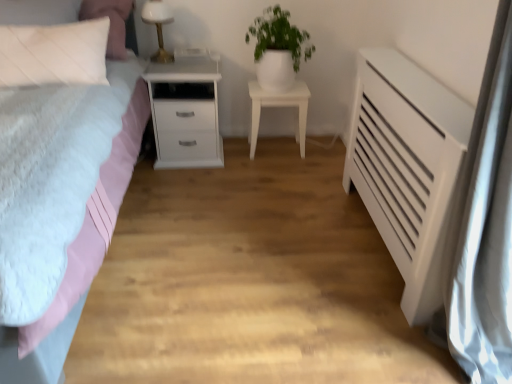
Describe the element at coordinates (158, 26) in the screenshot. This screenshot has height=384, width=512. I see `white glossy table lamp at upper center` at that location.

The image size is (512, 384). I want to click on white quilted pillow at upper left, so coord(54,53).

Describe the element at coordinates (186, 110) in the screenshot. Image resolution: width=512 pixels, height=384 pixels. I see `white matte nightstand at left, the 2th nightstand in the right-to-left sequence` at that location.

Identify the location of white glossy table lamp at upper center. (158, 26).

From the image's perspective, which is above, white glossy pot at upper center or white matte radiator at right?

white glossy pot at upper center.

Considering the positions of objects white glossy pot at upper center and white matte radiator at right in the image provided, who is more to the left, white glossy pot at upper center or white matte radiator at right?

→ white glossy pot at upper center is more to the left.

Is white glossy pot at upper center looking in the opposite direction of white matte radiator at right?

No, white glossy pot at upper center is not facing away from white matte radiator at right.

Where is `plant behind the white matte radiator at right`? plant behind the white matte radiator at right is located at coordinates (279, 36).

Is there a large distance between white glossy table lamp at upper center and matte pink bed at left?

No, white glossy table lamp at upper center is not far away from matte pink bed at left.

Could you tell me if white glossy table lamp at upper center is facing matte pink bed at left?

No, white glossy table lamp at upper center is not facing towards matte pink bed at left.

Can you confirm if white glossy table lamp at upper center is positioned to the right of matte pink bed at left?

Correct, you'll find white glossy table lamp at upper center to the right of matte pink bed at left.

Considering the points (157, 11) and (305, 116), which point is behind, point (157, 11) or point (305, 116)?

Positioned behind is point (305, 116).

From a real-world perspective, which is physically above, white glossy table lamp at upper center or white glossy nightstand at center, marked as the 1th nightstand in a right-to-left arrangement?

In real-world perspective, white glossy table lamp at upper center is above.

Measure the distance between white glossy table lamp at upper center and white glossy nightstand at center, marked as the 1th nightstand in a right-to-left arrangement.

30.68 inches.

From the picture: Does white glossy table lamp at upper center contain white glossy nightstand at center, acting as the second nightstand starting from the left?

No, white glossy nightstand at center, acting as the second nightstand starting from the left, is not inside white glossy table lamp at upper center.

From a real-world perspective, which object rests below the other?

white glossy nightstand at center, acting as the second nightstand starting from the left, is physically lower.

How different are the orientations of white matte radiator at right and white glossy nightstand at center, acting as the second nightstand starting from the left, in degrees?

84 degrees separate the facing orientations of white matte radiator at right and white glossy nightstand at center, acting as the second nightstand starting from the left.

Which object is further away from the camera, white matte radiator at right or white glossy nightstand at center, acting as the second nightstand starting from the left?

white glossy nightstand at center, acting as the second nightstand starting from the left, is behind.

Which object is wider, white matte radiator at right or white glossy nightstand at center, acting as the second nightstand starting from the left?

Wider between the two is white matte radiator at right.

Is the position of matte pink bed at left more distant than that of white glossy table lamp at upper center?

No, the depth of matte pink bed at left is less than that of white glossy table lamp at upper center.

Which of these two, matte pink bed at left or white glossy table lamp at upper center, is wider?

Wider between the two is matte pink bed at left.

Is point (31, 70) farther from viewer compared to point (161, 59)?

No, it is not.

Between white quilted pillow at upper left and white glossy table lamp at upper center, which one has larger width?

white quilted pillow at upper left.

The height and width of the screenshot is (384, 512). I want to click on table lamp above the white quilted pillow at upper left (from the image's perspective), so pyautogui.click(x=158, y=26).

Which of these two, white glossy pot at upper center or white quilted pillow at upper left, is smaller?

Smaller between the two is white quilted pillow at upper left.

Find the location of a particular element. The image size is (512, 384). plant above the white quilted pillow at upper left (from the image's perspective) is located at coordinates (279, 36).

Is white glossy pot at upper center further to camera compared to white quilted pillow at upper left?

Yes, white glossy pot at upper center is further from the viewer.

Considering the sizes of objects white glossy pot at upper center and white quilted pillow at upper left in the image provided, who is taller, white glossy pot at upper center or white quilted pillow at upper left?

Standing taller between the two is white glossy pot at upper center.

Image resolution: width=512 pixels, height=384 pixels. Identify the location of plant that is on the left side of white matte radiator at right. (279, 36).

The image size is (512, 384). What are the coordinates of `table lamp above the matte pink bed at left (from the image's perspective)` in the screenshot? It's located at (158, 26).

Considering their positions, is white glossy pot at upper center positioned further to white matte nightstand at left, marked as the 1th nightstand in a left-to-right arrangement, than white matte radiator at right?

white matte radiator at right is positioned further to the anchor white matte nightstand at left, marked as the 1th nightstand in a left-to-right arrangement.

From the image, which object appears to be nearer to matte pink bed at left, white glossy table lamp at upper center or white matte nightstand at left, marked as the 1th nightstand in a left-to-right arrangement?

white matte nightstand at left, marked as the 1th nightstand in a left-to-right arrangement.

Looking at the image, which one is located further to white matte radiator at right, white glossy table lamp at upper center or white matte nightstand at left, the 2th nightstand in the right-to-left sequence?

white glossy table lamp at upper center lies further to white matte radiator at right than the other object.

Looking at the image, which one is located further to white glossy table lamp at upper center, white matte nightstand at left, marked as the 1th nightstand in a left-to-right arrangement, or matte pink bed at left?

matte pink bed at left lies further to white glossy table lamp at upper center than the other object.

Estimate the real-world distances between objects in this image. Which object is further from white glossy pot at upper center, white glossy nightstand at center, acting as the second nightstand starting from the left, or white matte radiator at right?

Among the two, white matte radiator at right is located further to white glossy pot at upper center.

When comparing their distances from white glossy pot at upper center, does white matte radiator at right or matte pink bed at left seem closer?

matte pink bed at left.

Considering their positions, is white matte nightstand at left, the 2th nightstand in the right-to-left sequence, positioned closer to white glossy pot at upper center than matte pink bed at left?

white matte nightstand at left, the 2th nightstand in the right-to-left sequence.

Consider the image. Estimate the real-world distances between objects in this image. Which object is further from white glossy pot at upper center, matte pink bed at left or white glossy nightstand at center, acting as the second nightstand starting from the left?

The object further to white glossy pot at upper center is matte pink bed at left.

Find the location of a particular element. pillow between matte pink bed at left and white glossy nightstand at center, marked as the 1th nightstand in a right-to-left arrangement, along the z-axis is located at coordinates (54, 53).

Image resolution: width=512 pixels, height=384 pixels. Find the location of `plant between white matte nightstand at left, marked as the 1th nightstand in a left-to-right arrangement, and white glossy nightstand at center, acting as the second nightstand starting from the left`. plant between white matte nightstand at left, marked as the 1th nightstand in a left-to-right arrangement, and white glossy nightstand at center, acting as the second nightstand starting from the left is located at coordinates (279, 36).

In order to click on nightstand located between white matte radiator at right and white glossy table lamp at upper center in the depth direction in this screenshot , I will do `click(186, 110)`.

Where is `plant located between matte pink bed at left and white matte nightstand at left, the 2th nightstand in the right-to-left sequence, in the depth direction`? plant located between matte pink bed at left and white matte nightstand at left, the 2th nightstand in the right-to-left sequence, in the depth direction is located at coordinates (279, 36).